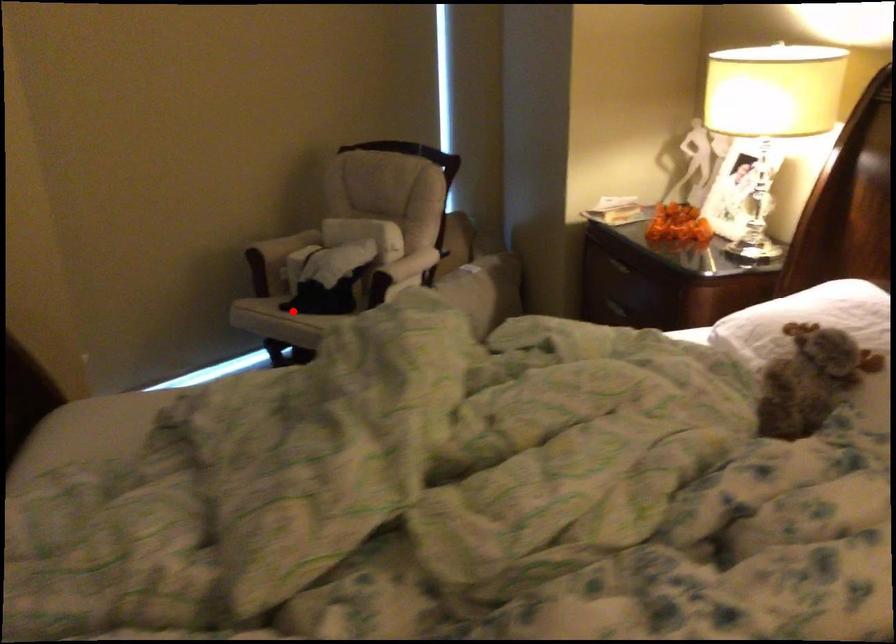
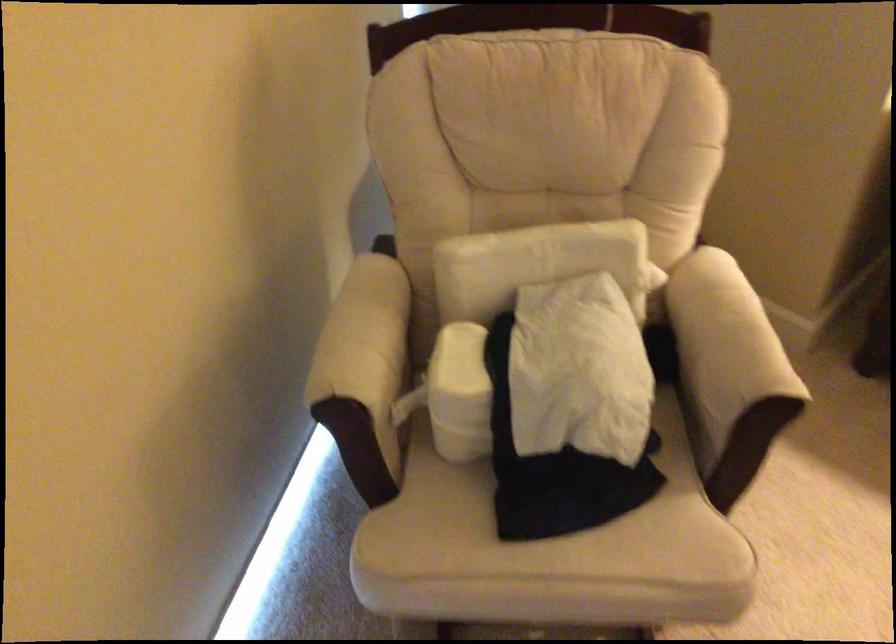
Question: A red point is marked in image1. In image2, is the corresponding 3D point closer to the camera or farther? Reply with the corresponding letter.

Choices:
 (A) The corresponding 3D point is closer.
 (B) The corresponding 3D point is farther.

Answer: (A)